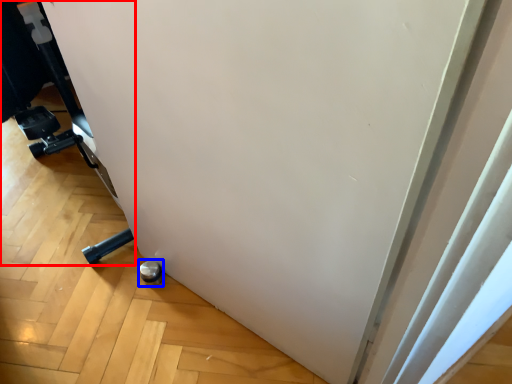
Question: Which point is further to the camera, furniture (highlighted by a red box) or wheel (highlighted by a blue box)?

Choices:
 (A) furniture
 (B) wheel

Answer: (B)